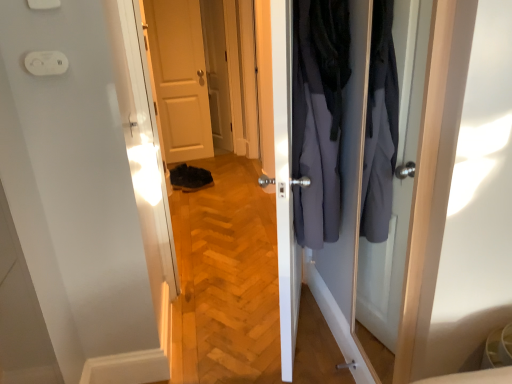
Question: Is there a large distance between dark gray fabric coat at center and matte white door at center?

Choices:
 (A) yes
 (B) no

Answer: (A)

Question: Considering the relative sizes of dark gray fabric coat at center and matte white door at center in the image provided, is dark gray fabric coat at center wider than matte white door at center?

Choices:
 (A) no
 (B) yes

Answer: (B)

Question: Does dark gray fabric coat at center lie in front of matte white door at center?

Choices:
 (A) no
 (B) yes

Answer: (B)

Question: Does dark gray fabric coat at center touch matte white door at center?

Choices:
 (A) yes
 (B) no

Answer: (B)

Question: Is dark gray fabric coat at center to the right of matte white door at center from the viewer's perspective?

Choices:
 (A) no
 (B) yes

Answer: (B)

Question: From a real-world perspective, is black suede shoe at lower center positioned above or below white plastic electric outlet at upper left?

Choices:
 (A) below
 (B) above

Answer: (A)

Question: Is black suede shoe at lower center bigger or smaller than white plastic electric outlet at upper left?

Choices:
 (A) big
 (B) small

Answer: (A)

Question: From their relative heights in the image, would you say black suede shoe at lower center is taller or shorter than white plastic electric outlet at upper left?

Choices:
 (A) tall
 (B) short

Answer: (A)

Question: Relative to white plastic electric outlet at upper left, is black suede shoe at lower center in front or behind?

Choices:
 (A) behind
 (B) front

Answer: (A)

Question: Considering the positions of white plastic electric outlet at upper left and dark gray fabric coat at center in the image, is white plastic electric outlet at upper left bigger or smaller than dark gray fabric coat at center?

Choices:
 (A) small
 (B) big

Answer: (A)

Question: Relative to dark gray fabric coat at center, is white plastic electric outlet at upper left in front or behind?

Choices:
 (A) behind
 (B) front

Answer: (A)

Question: From the image's perspective, is white plastic electric outlet at upper left positioned above or below dark gray fabric coat at center?

Choices:
 (A) above
 (B) below

Answer: (A)

Question: Considering the positions of white plastic electric outlet at upper left and dark gray fabric coat at center in the image, is white plastic electric outlet at upper left wider or thinner than dark gray fabric coat at center?

Choices:
 (A) thin
 (B) wide

Answer: (A)

Question: Is black suede shoe at lower center in front of or behind dark gray fabric coat at center in the image?

Choices:
 (A) behind
 (B) front

Answer: (A)

Question: Visually, is black suede shoe at lower center positioned to the left or to the right of dark gray fabric coat at center?

Choices:
 (A) right
 (B) left

Answer: (B)